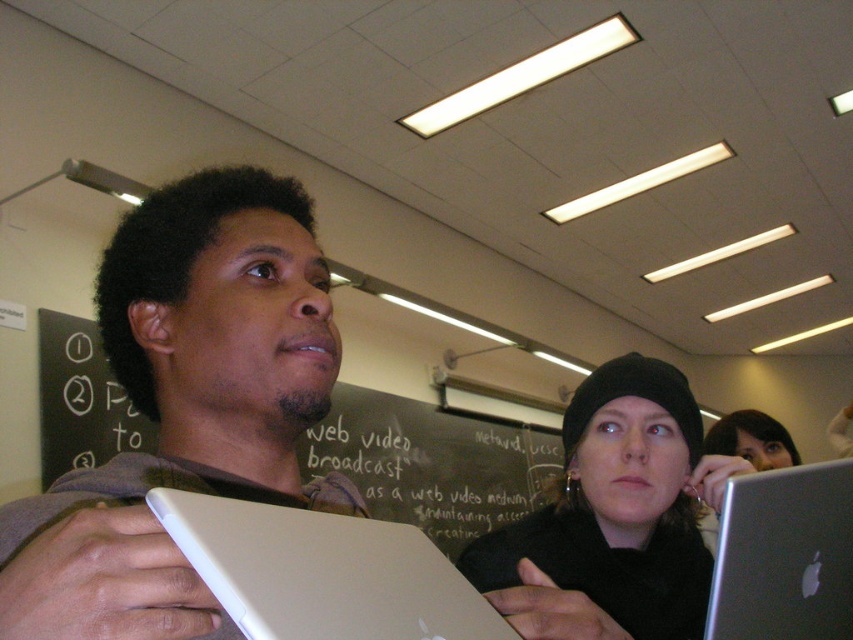
Question: Observing the image, what is the correct spatial positioning of black chalkboard at upper left in reference to silver metallic laptop at lower right?

Choices:
 (A) right
 (B) left

Answer: (B)

Question: Which object is closer to the camera taking this photo?

Choices:
 (A) black matte beanie at upper center
 (B) silver metallic tablet at center
 (C) white matte tablet at center

Answer: (C)

Question: Observing the image, what is the correct spatial positioning of silver metallic tablet at center in reference to black chalkboard at center?

Choices:
 (A) right
 (B) left

Answer: (B)

Question: Can you confirm if silver metallic tablet at center is positioned to the left of silver metallic laptop at lower right?

Choices:
 (A) yes
 (B) no

Answer: (A)

Question: Which point is farther from the camera taking this photo?

Choices:
 (A) (393, 484)
 (B) (233, 170)
 (C) (462, 636)
 (D) (366, 403)

Answer: (A)

Question: Considering the real-world distances, which object is closest to the black chalkboard at upper left?

Choices:
 (A) silver metallic laptop at lower right
 (B) black chalkboard at center
 (C) white matte tablet at center

Answer: (B)